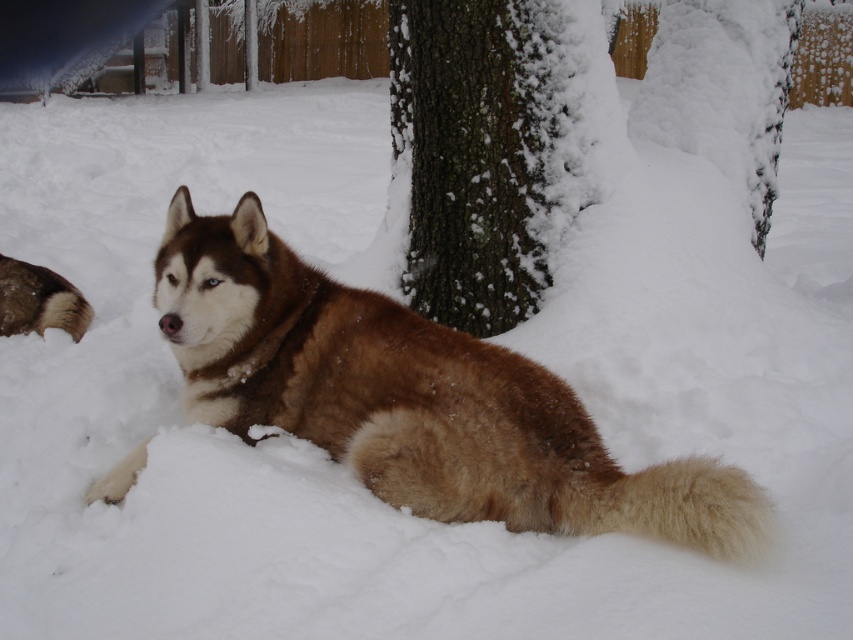
Question: Can you confirm if brown fur dog at center is thinner than snow-covered bark at center?

Choices:
 (A) yes
 (B) no

Answer: (B)

Question: Estimate the real-world distances between objects in this image. Which object is farther from the snow-covered bark at center?

Choices:
 (A) brown fur dog at center
 (B) brown fluffy tail at lower left

Answer: (B)

Question: Which of the following is the farthest from the observer?

Choices:
 (A) brown fur dog at center
 (B) snow-covered bark at upper center
 (C) brown fluffy tail at lower left
 (D) snow-covered bark at center

Answer: (C)

Question: Is brown fur dog at center to the right of snow-covered bark at upper center from the viewer's perspective?

Choices:
 (A) yes
 (B) no

Answer: (B)

Question: Is brown fur dog at center positioned in front of snow-covered bark at upper center?

Choices:
 (A) yes
 (B) no

Answer: (A)

Question: Which object appears farthest from the camera in this image?

Choices:
 (A) brown fur dog at center
 (B) snow-covered bark at upper center
 (C) snow-covered bark at center

Answer: (B)